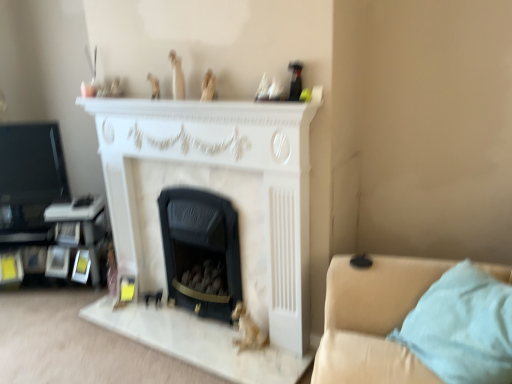
Locate an element on the screen. empty space that is to the right of gold metallic figurine at lower center, which is the fourth toy in left-to-right order is located at coordinates (284, 357).